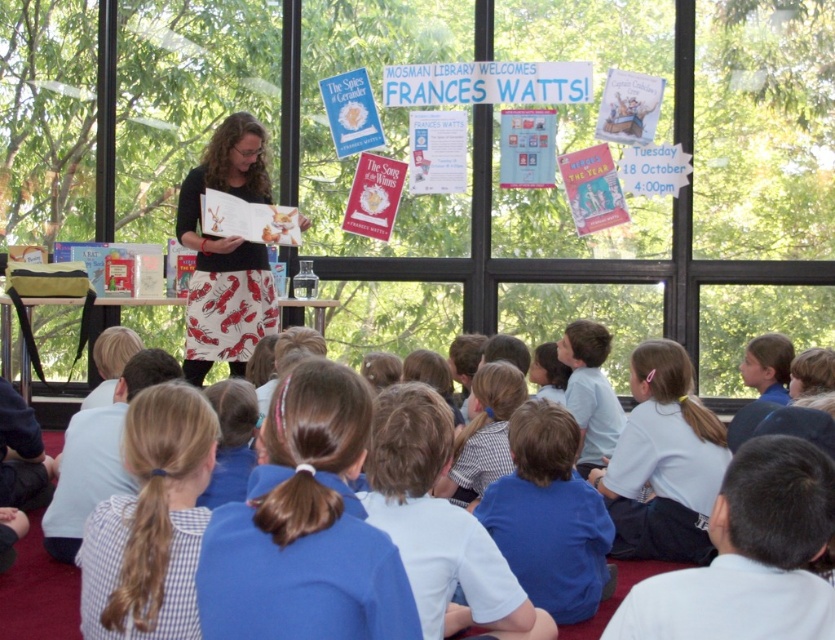
You are a photographer at Mosman Library and want to capture a photo of the blue fabric shirt at center and the matte paper book at center. To ensure both are in focus, you need to know their relative positions. Which object is on the right side when looking at the scene?

The blue fabric shirt at center is positioned on the right side of the matte paper book at center, so the blue fabric shirt at center is on the right.

You are a photographer positioned at the entrance of the library. You want to capture a closeup shot of the blue fabric ponytail at center. Given that your camera can focus on objects within 2 meters, will you be able to take the photo without moving closer?

The blue fabric ponytail at center is 2.57 meters away from the camera. Since your camera can only focus within 2 meters, you will need to move closer to take the closeup shot.